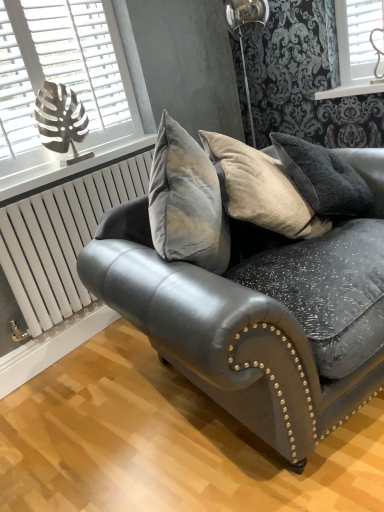
At what (x,y) coordinates should I click in order to perform the action: click on vacant space situated above white metallic radiator at lower left (from a real-world perspective). Please return your answer as a coordinate pair (x, y). Looking at the image, I should click on (82, 176).